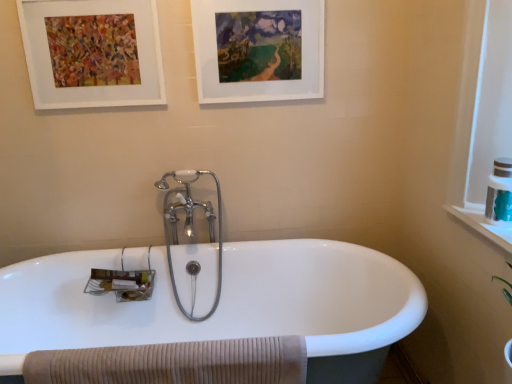
Question: Based on their sizes in the image, would you say white ceramic bathtub at center is bigger or smaller than teal plastic toiletry at right?

Choices:
 (A) small
 (B) big

Answer: (B)

Question: Considering the relative positions of white ceramic bathtub at center and teal plastic toiletry at right in the image provided, is white ceramic bathtub at center to the left or to the right of teal plastic toiletry at right?

Choices:
 (A) right
 (B) left

Answer: (B)

Question: Which object is positioned farthest from the beige ribbed towel at lower left?

Choices:
 (A) polished chrome faucet at center
 (B) white matte picture frame at upper left, placed as the 1th picture frame when sorted from left to right
 (C) white matte picture frame at upper center, the second picture frame viewed from the left
 (D) white ceramic bathtub at center
 (E) teal plastic toiletry at right

Answer: (C)

Question: Which object is the farthest from the white matte picture frame at upper left, placed as the 1th picture frame when sorted from left to right?

Choices:
 (A) white ceramic bathtub at center
 (B) polished chrome faucet at center
 (C) white matte picture frame at upper center, arranged as the 1th picture frame when viewed from the right
 (D) teal plastic toiletry at right
 (E) beige ribbed towel at lower left

Answer: (D)